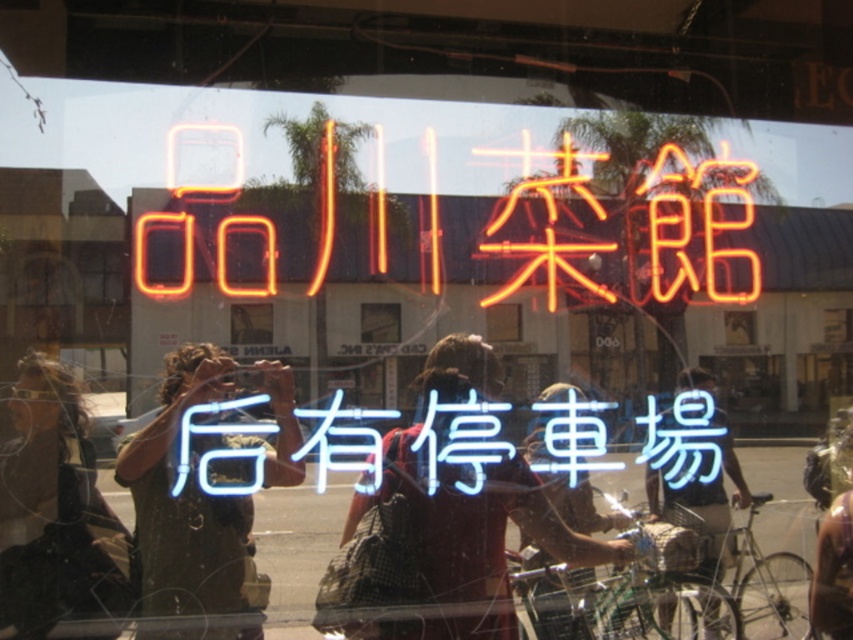
Which is below, dark brown leather jacket at lower left or neon orange sign at upper center?

Positioned lower is dark brown leather jacket at lower left.

Find the location of a particular element. This screenshot has height=640, width=853. dark brown leather jacket at lower left is located at coordinates (61, 518).

Does red fabric shirt at center appear under neon orange sign at upper center?

Correct, red fabric shirt at center is located below neon orange sign at upper center.

Where is `red fabric shirt at center`? This screenshot has width=853, height=640. red fabric shirt at center is located at coordinates (469, 509).

Is dark brown leather jacket at lower left positioned at the back of neon orange characters at center?

That is False.

Where is `dark brown leather jacket at lower left`? The width and height of the screenshot is (853, 640). dark brown leather jacket at lower left is located at coordinates (61, 518).